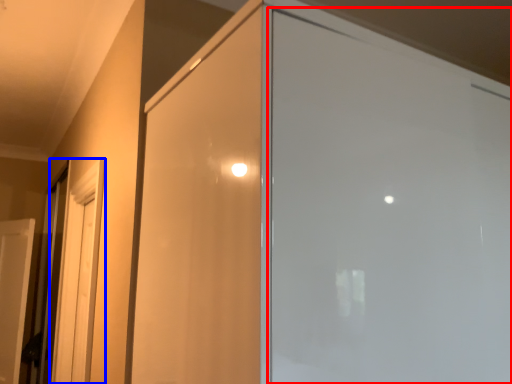
Question: Which point is further to the camera, screen door (highlighted by a red box) or screen door (highlighted by a blue box)?

Choices:
 (A) screen door
 (B) screen door

Answer: (B)